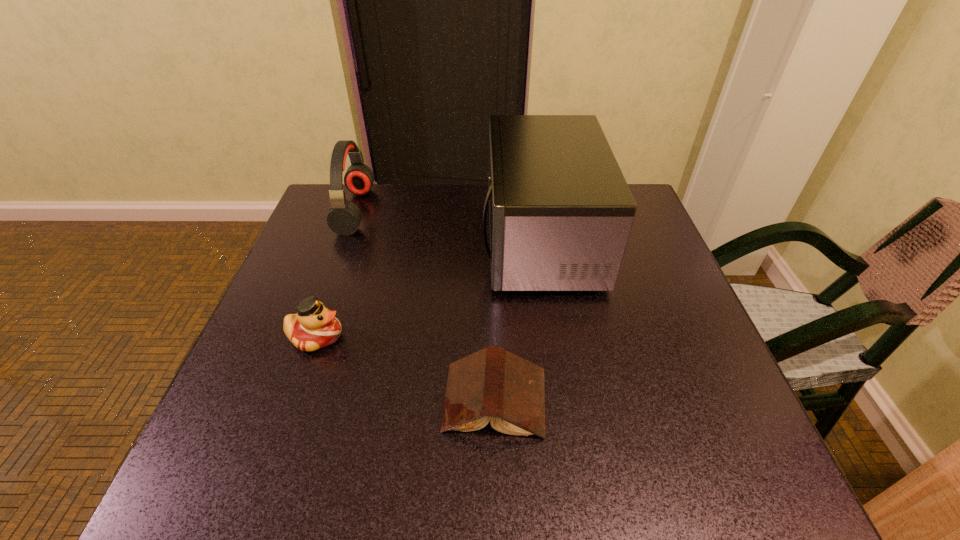
Image resolution: width=960 pixels, height=540 pixels. I want to click on vacant space at the far edge of the desktop, so click(x=398, y=184).

This screenshot has height=540, width=960. I want to click on free region at the near edge of the desktop, so point(363,438).

This screenshot has width=960, height=540. I want to click on vacant point at the left edge, so click(x=346, y=267).

The width and height of the screenshot is (960, 540). What are the coordinates of `blank space at the right edge of the desktop` in the screenshot? It's located at (662, 375).

The width and height of the screenshot is (960, 540). I want to click on empty location between the shortest object and the tallest object, so click(x=517, y=320).

Where is `free space between the book and the duck`? This screenshot has height=540, width=960. free space between the book and the duck is located at coordinates (405, 368).

Locate an element on the screen. free space between the third shortest object and the third tallest object is located at coordinates (336, 273).

Where is `vacant area between the second tallest object and the microwave oven`? vacant area between the second tallest object and the microwave oven is located at coordinates (448, 225).

The image size is (960, 540). Identify the location of free space between the earphone and the tallest object. (448, 225).

Find the location of a particular element. The height and width of the screenshot is (540, 960). free space between the second shortest object and the book is located at coordinates (405, 368).